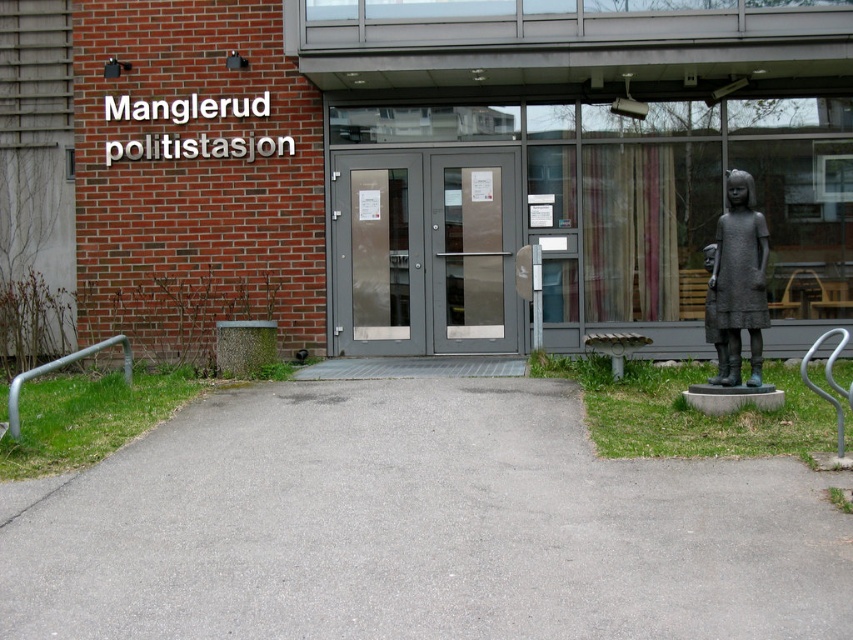
You are a delivery person arriving at Manglerud Police Station. You need to determine which object is wider between the matte gray doors at center and the bronze statue at right. Based on the scene, which one is wider?

The matte gray doors at center are wider than the bronze statue at right according to the description.

In the scene shown: You are standing at the entrance of Manglerud Police Station and want to enter. The bronze statue at right is blocking your path. Can you walk around it to reach the matte gray doors at center?

The matte gray doors at center are closer to you than the bronze statue at right, so you can walk around the bronze statue at right to reach the matte gray doors at center.